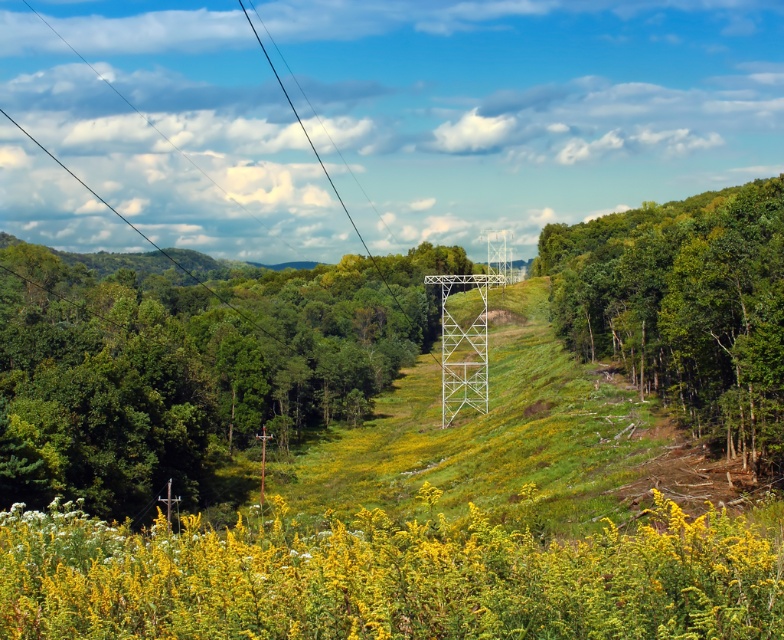
Measure the distance between yellow-green textured wildflowers at center and black wire at center.

1022.93 feet

Can you confirm if yellow-green textured wildflowers at center is bigger than black wire at center?

Actually, yellow-green textured wildflowers at center might be smaller than black wire at center.

Where is `yellow-green textured wildflowers at center`? yellow-green textured wildflowers at center is located at coordinates (385, 579).

Who is taller, green matte tree at center or black wire at center?

With more height is black wire at center.

Which of these two, green matte tree at center or black wire at center, stands shorter?

Standing shorter between the two is green matte tree at center.

Is point (329, 372) closer to camera compared to point (311, 148)?

Yes, point (329, 372) is in front of point (311, 148).

At what (x,y) coordinates should I click in order to perform the action: click on green matte tree at center. Please return your answer as a coordinate pair (x, y). This screenshot has height=640, width=784. Looking at the image, I should click on (187, 365).

Between point (714, 422) and point (398, 304), which one is positioned in front?

Point (714, 422) is more forward.

Is green leafy tree at right below black wire at upper center?

Yes, green leafy tree at right is below black wire at upper center.

At what (x,y) coordinates should I click in order to perform the action: click on green leafy tree at right. Please return your answer as a coordinate pair (x, y). Looking at the image, I should click on (684, 307).